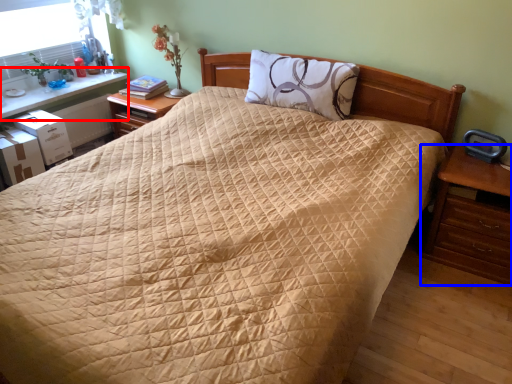
Question: Among these objects, which one is nearest to the camera, table (highlighted by a red box) or nightstand (highlighted by a blue box)?

Choices:
 (A) table
 (B) nightstand

Answer: (B)